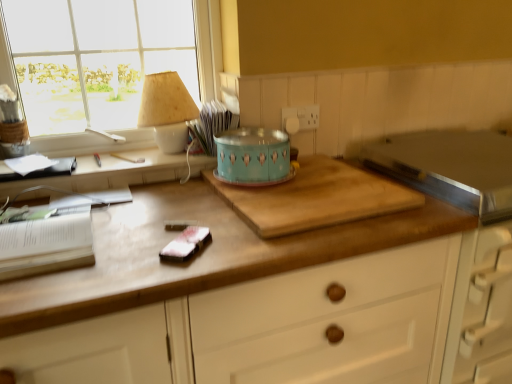
Identify the location of vacant area that lies to the right of satin pink fabric at center. (254, 238).